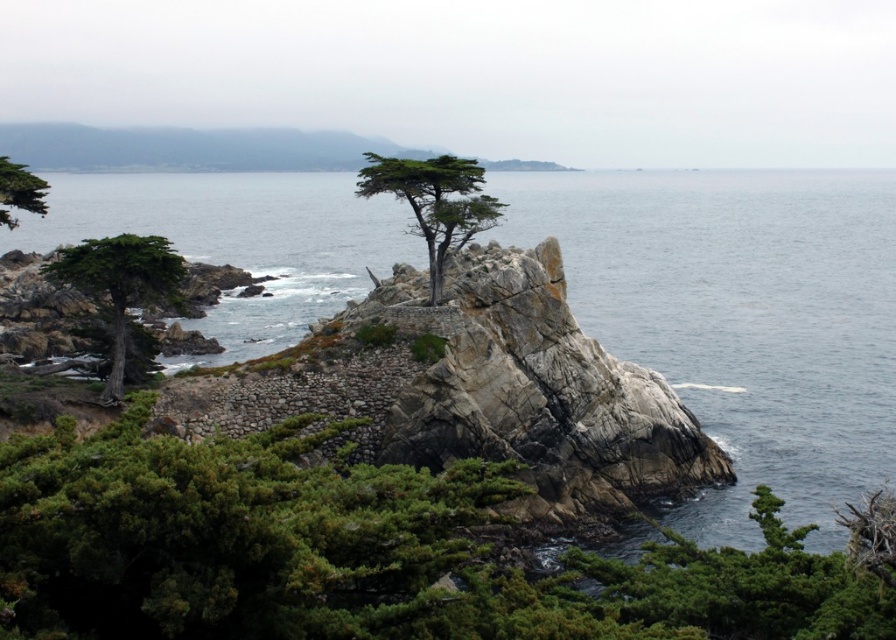
Question: Is green matte tree at left in front of green matte tree at upper left?

Choices:
 (A) yes
 (B) no

Answer: (A)

Question: Is green matte tree at left below green matte tree at upper left?

Choices:
 (A) yes
 (B) no

Answer: (A)

Question: Which of these objects is positioned farthest from the green matte tree at left?

Choices:
 (A) clear blue water at center
 (B) green textured tree at center
 (C) green matte tree at upper left

Answer: (A)

Question: Among these objects, which one is nearest to the camera?

Choices:
 (A) green matte tree at upper left
 (B) green textured tree at center
 (C) clear blue water at center
 (D) green matte tree at left

Answer: (D)

Question: Which point is closer to the camera?

Choices:
 (A) (138, 256)
 (B) (533, 225)

Answer: (A)

Question: Can you confirm if clear blue water at center is thinner than green matte tree at left?

Choices:
 (A) no
 (B) yes

Answer: (A)